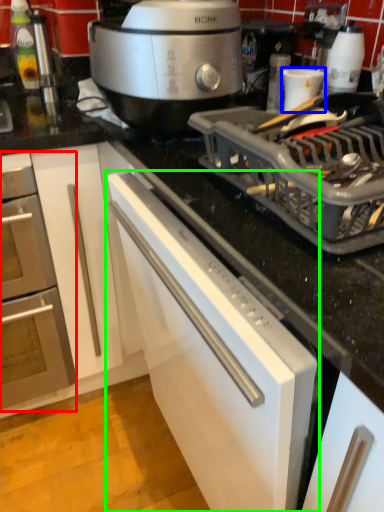
Question: Based on their relative distances, which object is farther from home appliance (highlighted by a red box)? Choose from appliance (highlighted by a blue box) and cabinetry (highlighted by a green box).

Choices:
 (A) appliance
 (B) cabinetry

Answer: (A)